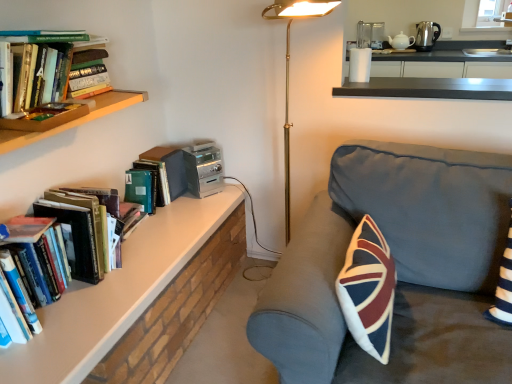
Find the location of a particular element. Image resolution: width=512 pixels, height=384 pixels. free space between hardcover book at upper left, which appears as the third book when viewed from the front, and silver metallic stereo at upper center, the 1th appliance in the left-to-right sequence is located at coordinates (181, 207).